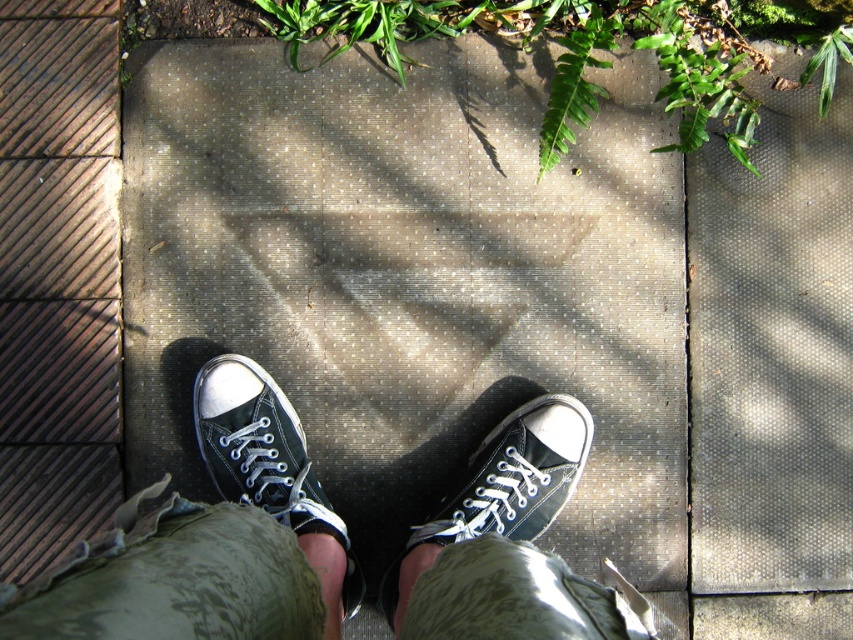
You are a photographer trying to capture both the matte black sneaker at center and the black canvas shoe at center in a single shot. Since the camera can only focus on one object at a time, which object should you focus on first to ensure the other is still in the frame?

The matte black sneaker at center is positioned on the left side of black canvas shoe at center, so focusing on the black canvas shoe at center first would keep the matte black sneaker at center within the frame as it is to the left.

You are a photographer trying to capture the texture of the mat between the black canvas shoes at center and the matte black sneaker at center. Since the mat has a grid pattern with raised dots, which object is closer to the mat to better show its texture?

The black canvas shoes at center is below matte black sneaker at center, so the black canvas shoes at center is closer to the mat and would better show its texture.

You are a photographer taking a picture of the matte black sneaker at center. The camera is positioned directly above it. What are the coordinates of the sneaker in the image?

The coordinates of the matte black sneaker at center are at point (271,470).